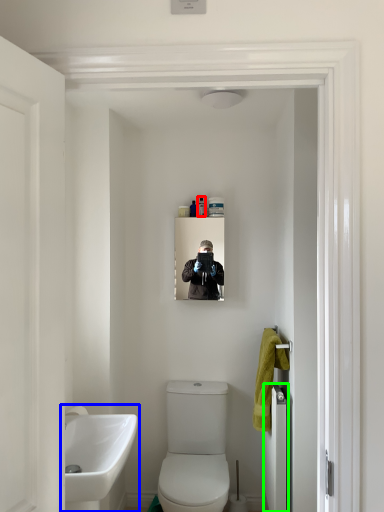
Question: Estimate the real-world distances between objects in this image. Which object is farther from toiletry (highlighted by a red box), sink (highlighted by a blue box) or door (highlighted by a green box)?

Choices:
 (A) sink
 (B) door

Answer: (A)